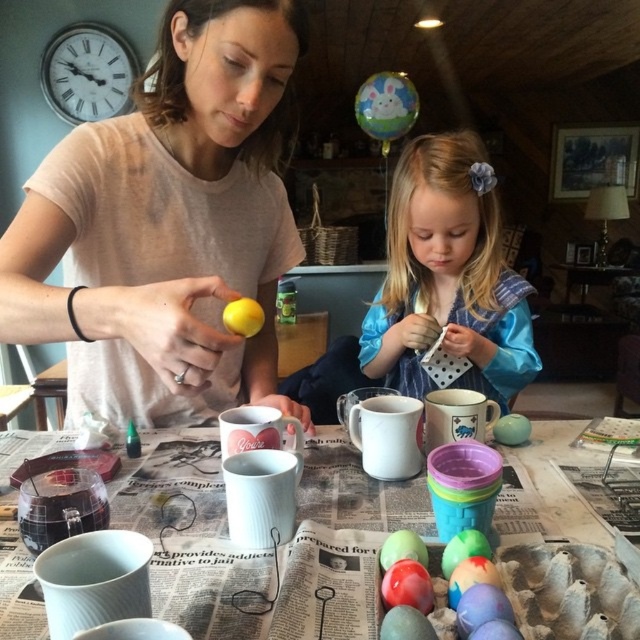
Between blue satin dress at center and smooth matte green egg at center, which one appears on the right side from the viewer's perspective?

From the viewer's perspective, blue satin dress at center appears more on the right side.

Does blue satin dress at center appear on the right side of smooth matte green egg at center?

Indeed, blue satin dress at center is positioned on the right side of smooth matte green egg at center.

Locate an element on the screen. blue satin dress at center is located at coordinates (449, 276).

Can you confirm if matte pastel egg at lower center is positioned above yellow matte lemon at center?

Actually, matte pastel egg at lower center is below yellow matte lemon at center.

At what (x,y) coordinates should I click in order to perform the action: click on matte pastel egg at lower center. Please return your answer as a coordinate pair (x, y). The height and width of the screenshot is (640, 640). Looking at the image, I should click on (404, 625).

Who is more forward, (420,628) or (257,328)?

Point (420,628) is in front.

In order to click on matte pastel egg at lower center in this screenshot , I will do `click(404, 625)`.

Is matte ceramic cups at center smaller than yellow matte lemon at center?

Actually, matte ceramic cups at center might be larger than yellow matte lemon at center.

Is point (532, 596) farther from viewer compared to point (243, 316)?

No, it is in front of (243, 316).

Identify the location of matte ceramic cups at center. (269, 550).